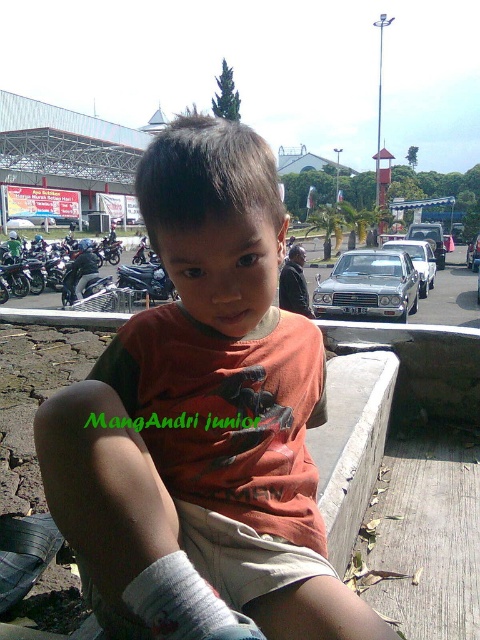
You are a delivery driver who needs to park your shiny silver car at center and silver metallic sedan at center in a narrow alley where only one vehicle can fit at a time. According to the image, which vehicle should you park first to ensure both can fit?

The shiny silver car at center is positioned on the left side of silver metallic sedan at center. Since the alley can only fit one vehicle at a time, you should park the shiny silver car at center first, then the silver metallic sedan at center, as they are aligned from left to right.

Looking at this image, you are a pedestrian crossing the street and see the white fabric sock at lower left and the silver metallic sedan at center. Which object is closer to the street?

The white fabric sock at lower left is positioned under the silver metallic sedan at center, so it is closer to the street than the sedan.

You are a delivery person who needs to park your van between the shiny silver car at center and the silver metallic sedan at center. The van is 5 meters long. Is there enough space between them to park your van?

The distance between the shiny silver car at center and the silver metallic sedan at center is 3.03 meters. Since the van is 5 meters long, there isn not enough space to park between them.